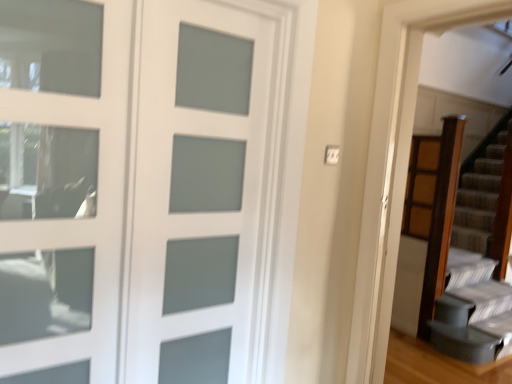
Question: Considering the relative positions of white frosted glass door at center and satin glass door at upper left in the image provided, is white frosted glass door at center to the left or to the right of satin glass door at upper left?

Choices:
 (A) right
 (B) left

Answer: (A)

Question: Based on their sizes in the image, would you say white frosted glass door at center is bigger or smaller than satin glass door at upper left?

Choices:
 (A) small
 (B) big

Answer: (B)

Question: From the image's perspective, relative to satin glass door at upper left, is white frosted glass door at center above or below?

Choices:
 (A) below
 (B) above

Answer: (A)

Question: Based on their positions, is satin glass door at upper left located to the left or right of white frosted glass door at center?

Choices:
 (A) right
 (B) left

Answer: (B)

Question: In terms of height, does satin glass door at upper left look taller or shorter compared to white frosted glass door at center?

Choices:
 (A) tall
 (B) short

Answer: (B)

Question: Is satin glass door at upper left inside or outside of white frosted glass door at center?

Choices:
 (A) outside
 (B) inside

Answer: (A)

Question: From a real-world perspective, is satin glass door at upper left physically located above or below white frosted glass door at center?

Choices:
 (A) above
 (B) below

Answer: (A)